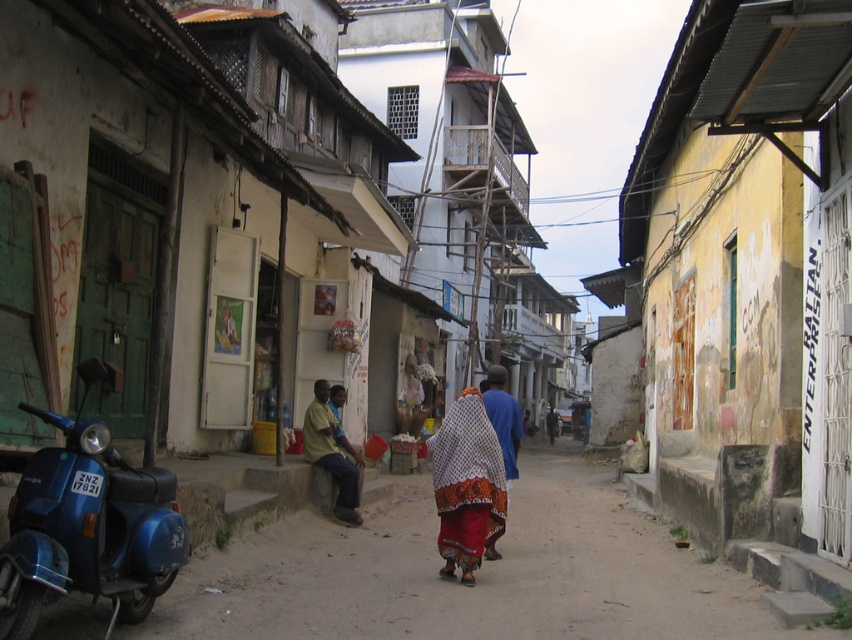
Question: Can you confirm if metallic blue scooter at left is smaller than yellow cotton shirt at center?

Choices:
 (A) yes
 (B) no

Answer: (B)

Question: Which of the following is the farthest from the observer?

Choices:
 (A) (145, 596)
 (B) (487, 404)

Answer: (B)

Question: From the image, what is the correct spatial relationship of yellow cotton shirt at center in relation to orange printed fabric at center?

Choices:
 (A) left
 (B) right

Answer: (A)

Question: Which point is closer to the camera taking this photo?

Choices:
 (A) (341, 477)
 (B) (517, 476)
 (C) (442, 480)

Answer: (C)

Question: Among these objects, which one is farthest from the camera?

Choices:
 (A) metallic blue scooter at left
 (B) yellow cotton shirt at center

Answer: (B)

Question: From the image, what is the correct spatial relationship of metallic blue scooter at left in relation to orange printed fabric at center?

Choices:
 (A) right
 (B) left

Answer: (B)